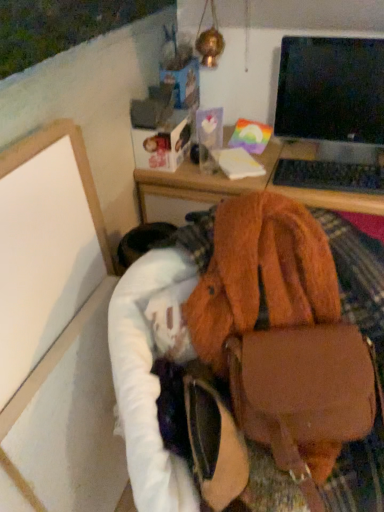
Question: Is white matte board at lower left far away from black glossy monitor at upper right?

Choices:
 (A) yes
 (B) no

Answer: (B)

Question: Is black glossy monitor at upper right inside white matte board at lower left?

Choices:
 (A) yes
 (B) no

Answer: (B)

Question: Does white matte board at lower left appear on the right side of black glossy monitor at upper right?

Choices:
 (A) no
 (B) yes

Answer: (A)

Question: Is white matte board at lower left facing away from black glossy monitor at upper right?

Choices:
 (A) no
 (B) yes

Answer: (A)

Question: Is white matte board at lower left not within black glossy monitor at upper right?

Choices:
 (A) yes
 (B) no

Answer: (A)

Question: Would you say white matte board at lower left is to the left or to the right of black plastic keyboard at upper right in the picture?

Choices:
 (A) left
 (B) right

Answer: (A)

Question: In terms of size, does white matte board at lower left appear bigger or smaller than black plastic keyboard at upper right?

Choices:
 (A) small
 (B) big

Answer: (B)

Question: Is white matte board at lower left situated inside black plastic keyboard at upper right or outside?

Choices:
 (A) inside
 (B) outside

Answer: (B)

Question: From the image's perspective, is white matte board at lower left positioned above or below black plastic keyboard at upper right?

Choices:
 (A) below
 (B) above

Answer: (A)

Question: Is point (281, 111) positioned closer to the camera than point (77, 200)?

Choices:
 (A) closer
 (B) farther

Answer: (B)

Question: In the image, is black glossy monitor at upper right positioned in front of or behind white matte board at lower left?

Choices:
 (A) front
 (B) behind

Answer: (B)

Question: From a real-world perspective, is black glossy monitor at upper right above or below white matte board at lower left?

Choices:
 (A) below
 (B) above

Answer: (B)

Question: Would you say black glossy monitor at upper right is to the left or to the right of white matte board at lower left in the picture?

Choices:
 (A) left
 (B) right

Answer: (B)

Question: Considering the positions of point (334, 183) and point (347, 94), is point (334, 183) closer or farther from the camera than point (347, 94)?

Choices:
 (A) farther
 (B) closer

Answer: (B)

Question: Considering their positions, is black plastic keyboard at upper right located in front of or behind black glossy monitor at upper right?

Choices:
 (A) front
 (B) behind

Answer: (B)